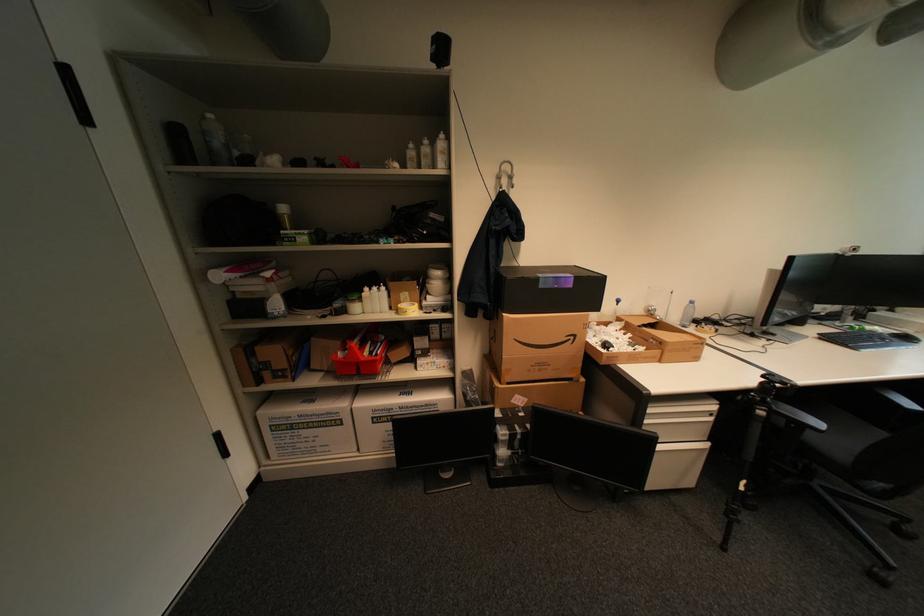
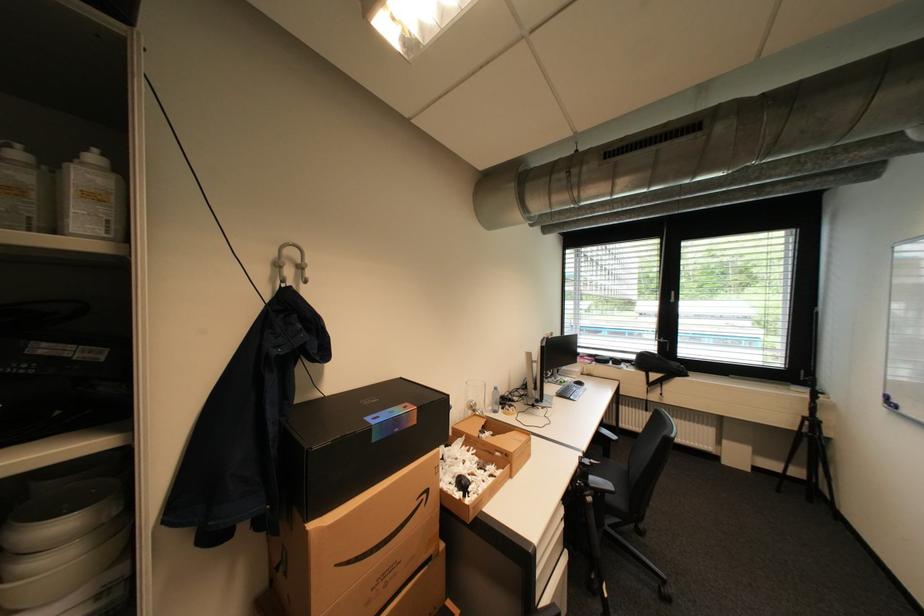
The point at (767, 399) is marked in the first image. Where is the corresponding point in the second image?

(591, 485)